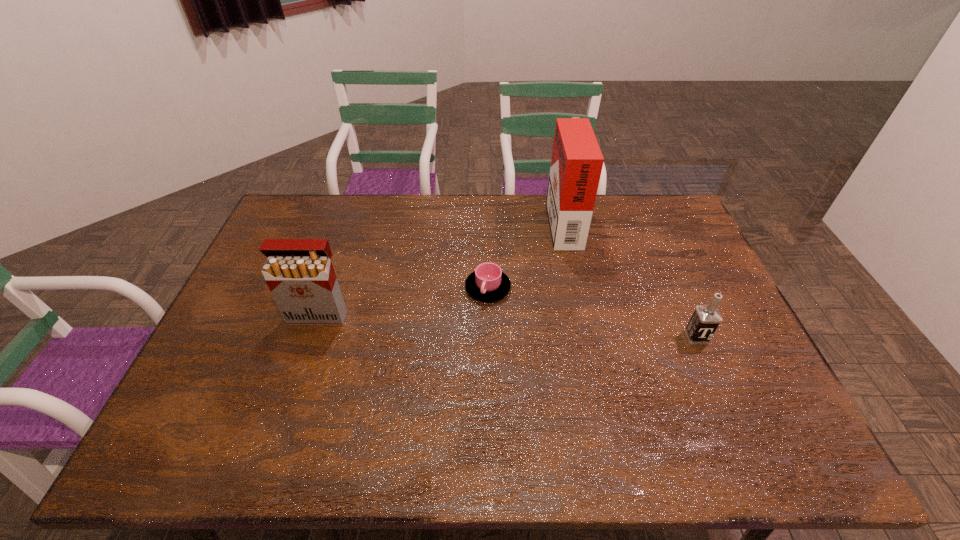
You are a GUI agent. You are given a task and a screenshot of the screen. Output one action in this format:
    pyautogui.click(x=<x>, y=<y>)
    Task: Click on the vacant space in between the third nearest object and the second shortest object
    The width and height of the screenshot is (960, 540).
    Given the screenshot: What is the action you would take?
    pyautogui.click(x=592, y=313)

Locate which object ranks third in proximity to the second farthest object. Please provide its 2D coordinates. Your answer should be formatted as a tuple, i.e. [(x, y)], where the tuple contains the x and y coordinates of a point satisfying the conditions above.

[(705, 320)]

At what (x,y) coordinates should I click in order to perform the action: click on object that is the third closest to the third nearest object. Please return your answer as a coordinate pair (x, y). The width and height of the screenshot is (960, 540). Looking at the image, I should click on (705, 320).

Find the location of a particular element. This screenshot has width=960, height=540. free location that satisfies the following two spatial constraints: 1. on the front-facing side of the tallest object; 2. with the lid open on the nearer cigarette case is located at coordinates (584, 316).

The image size is (960, 540). I want to click on free spot that satisfies the following two spatial constraints: 1. on the front-facing side of the taller cigarette case; 2. with the lid open on the nearer cigarette case, so click(x=584, y=316).

Identify the location of vacant space that satisfies the following two spatial constraints: 1. on the front-facing side of the tallest object; 2. with the lid open on the leftmost object. (584, 316).

Where is `blank space that satisfies the following two spatial constraints: 1. on the front-facing side of the farther cigarette case; 2. on the side with the handle of the cup`? The width and height of the screenshot is (960, 540). blank space that satisfies the following two spatial constraints: 1. on the front-facing side of the farther cigarette case; 2. on the side with the handle of the cup is located at coordinates (577, 288).